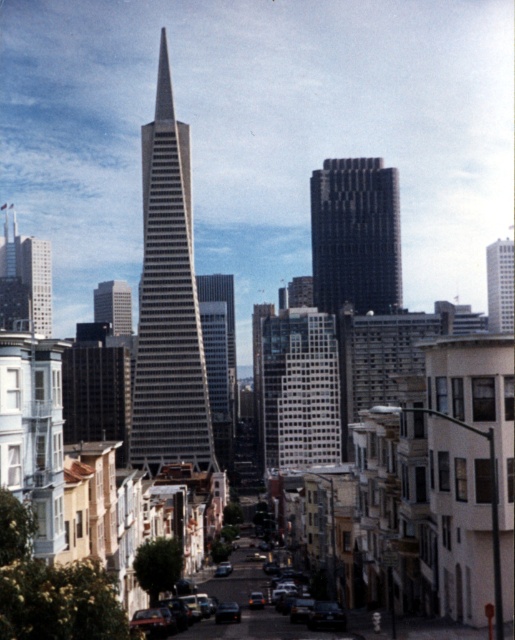
You are a drone operator trying to capture the glassy reflective skyscraper at center. Your drone is currently above the point at coordinates point (227, 323). According to the scene description, what is the building you are directly above?

The point at coordinates point (227, 323) indicates the glassy reflective skyscraper at center.

You are standing at the base of the modern triangular skyscraper and want to walk towards the point labeled point (123, 328). However, you notice another point labeled point (374, 168) blocking your path. Based on the scene description, can you determine if you can walk directly to your destination without going around the blocking point?

Point (374, 168) is in front of point (123, 328), so you cannot walk directly to point (123, 328) without going around the blocking point (374, 168).